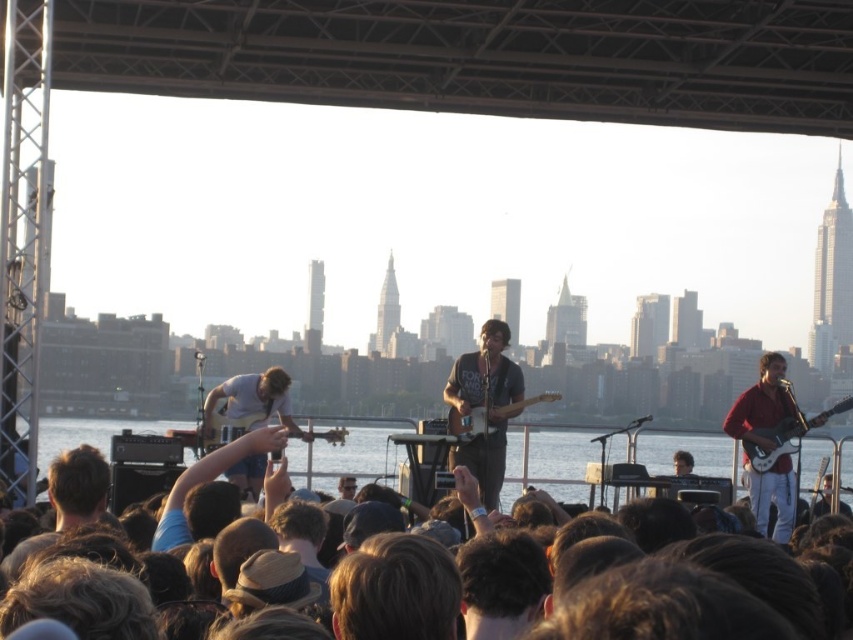
Question: Which of these objects is positioned closest to the matte black guitar at center?

Choices:
 (A) wooden electric guitar at center
 (B) white glossy electric guitar at right
 (C) shiny red guitar at right

Answer: (A)

Question: Does shiny red guitar at right appear over white glossy electric guitar at right?

Choices:
 (A) yes
 (B) no

Answer: (B)

Question: Based on their relative distances, which object is farther from the matte black guitar at center?

Choices:
 (A) shiny red guitar at right
 (B) wooden electric guitar at center

Answer: (A)

Question: Among these points, which one is nearest to the camera?

Choices:
 (A) (514, 404)
 (B) (47, 445)

Answer: (A)

Question: Does clear water at stage center appear over matte black guitar at center?

Choices:
 (A) yes
 (B) no

Answer: (B)

Question: Does brown hair at lower center appear on the left side of shiny red guitar at right?

Choices:
 (A) yes
 (B) no

Answer: (A)